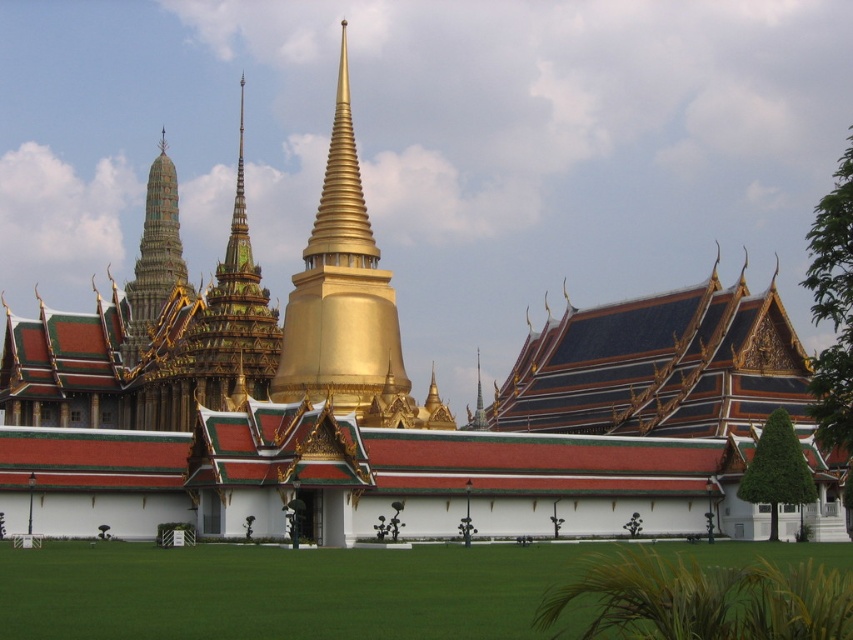
Who is taller, gold polished spire at center or green textured spire at upper left?

With more height is gold polished spire at center.

Between gold polished spire at center and green textured spire at upper left, which one is positioned lower?

green textured spire at upper left is below.

Locate an element on the screen. gold polished spire at center is located at coordinates (341, 292).